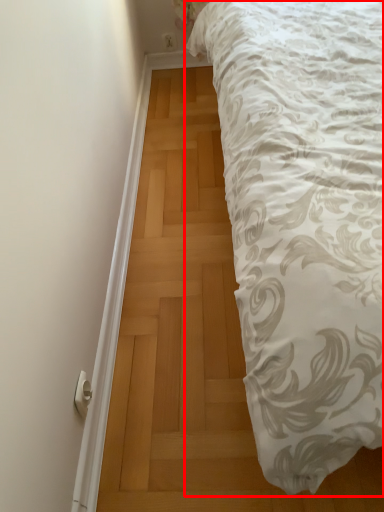
Question: Considering the relative positions of bed (annotated by the red box) and door handle in the image provided, where is bed (annotated by the red box) located with respect to the staircase?

Choices:
 (A) left
 (B) right

Answer: (B)